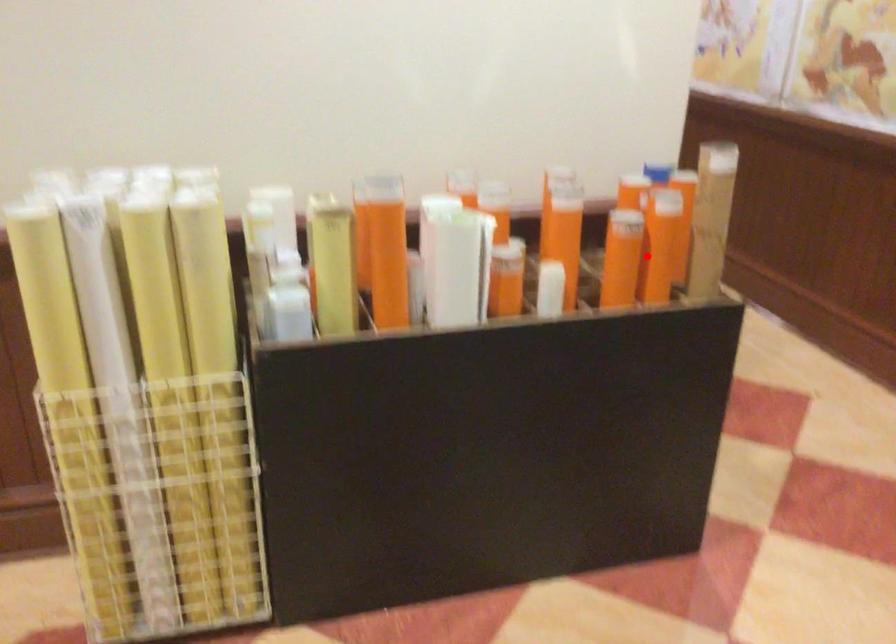
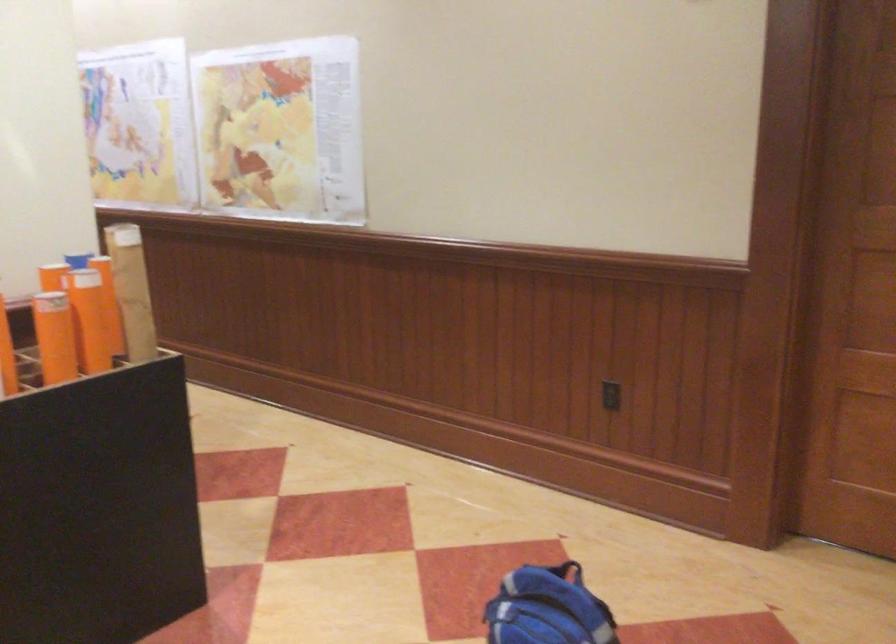
In the second image, find the point that corresponds to the highlighted location in the first image.

(99, 330)